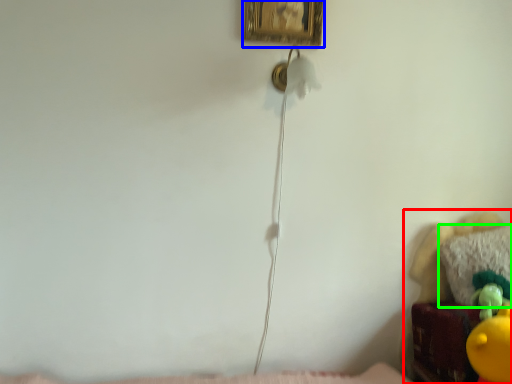
Question: Which object is the closest to the furniture (highlighted by a red box)? Choose among these: picture frame (highlighted by a blue box) or pillow (highlighted by a green box).

Choices:
 (A) picture frame
 (B) pillow

Answer: (B)